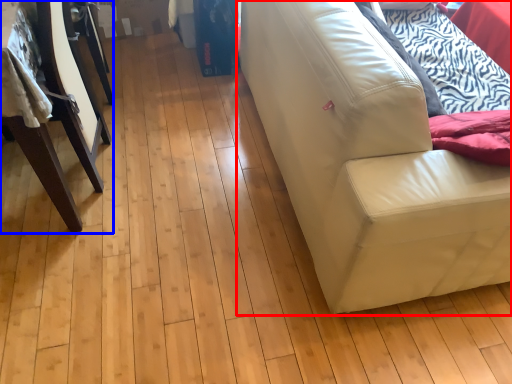
Question: Which point is further to the camera, studio couch (highlighted by a red box) or furniture (highlighted by a blue box)?

Choices:
 (A) studio couch
 (B) furniture

Answer: (B)